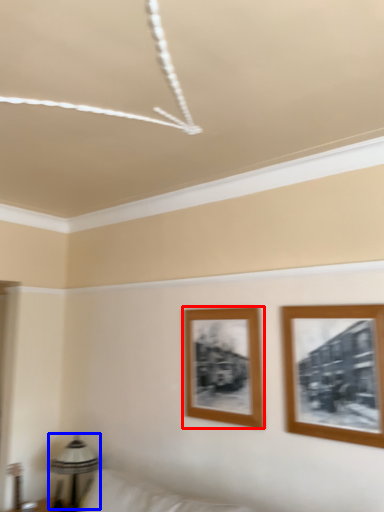
Question: Which of the following is the farthest to the observer, picture frame (highlighted by a red box) or table lamp (highlighted by a blue box)?

Choices:
 (A) picture frame
 (B) table lamp

Answer: (B)